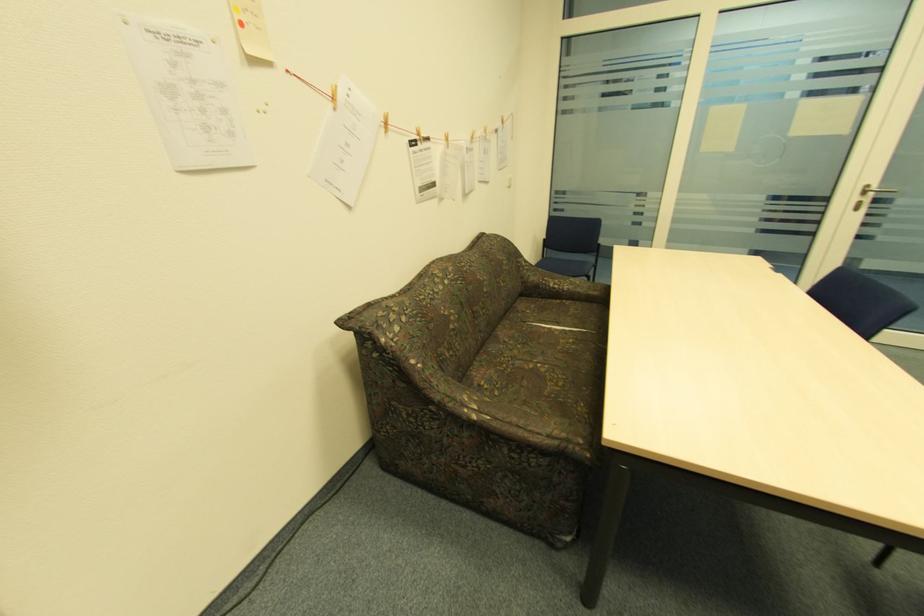
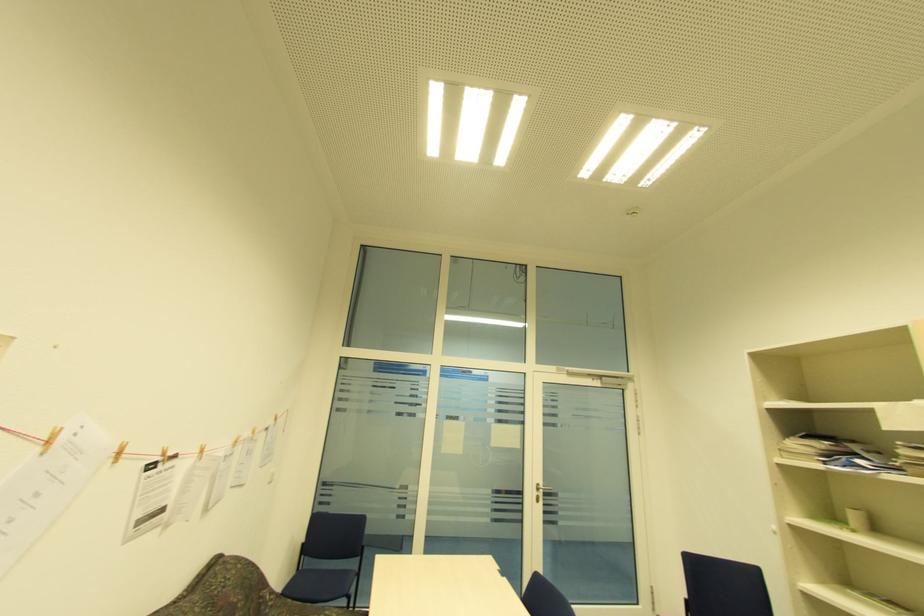
How did the camera likely rotate?

The camera rotated toward right-up.